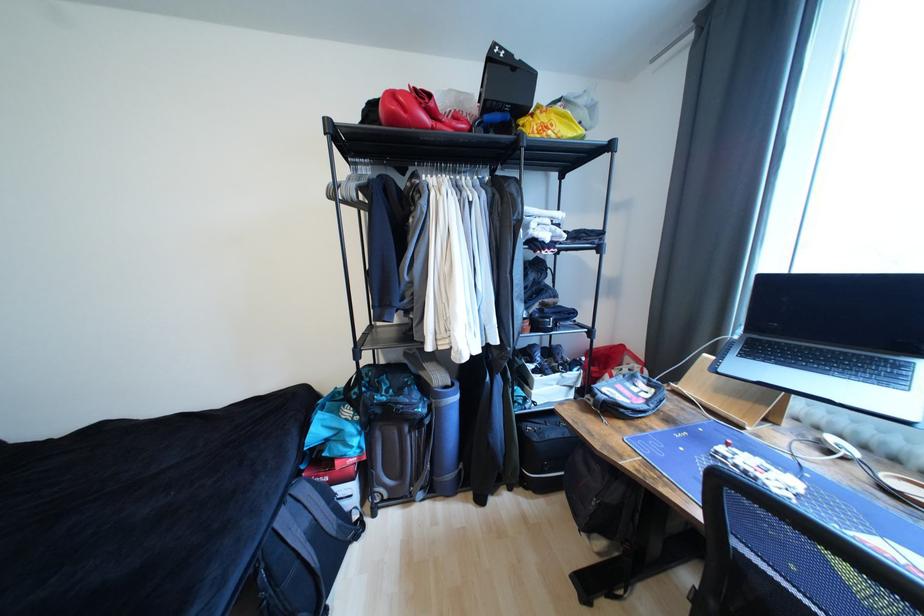
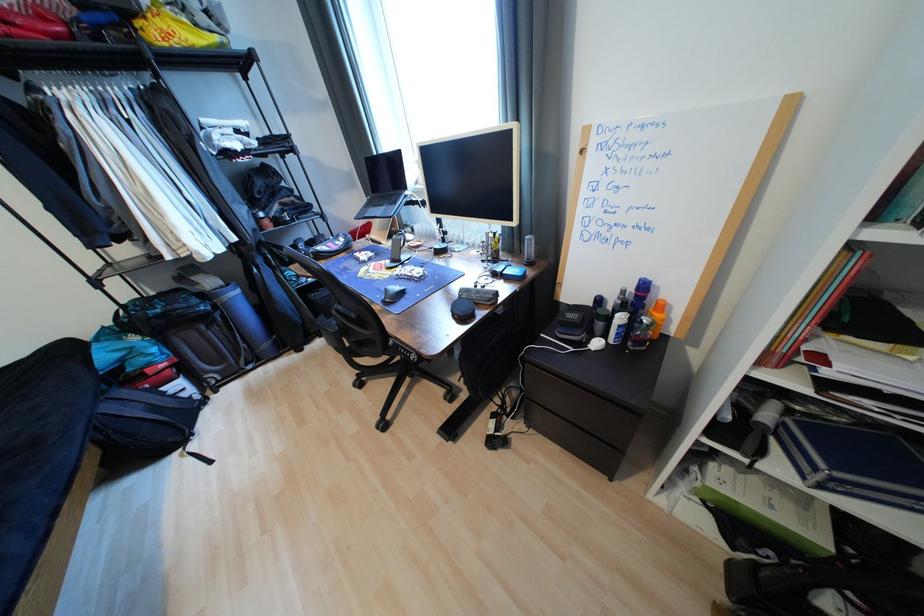
Locate, in the second image, the point that corresponds to [588,132] in the first image.

(223, 39)